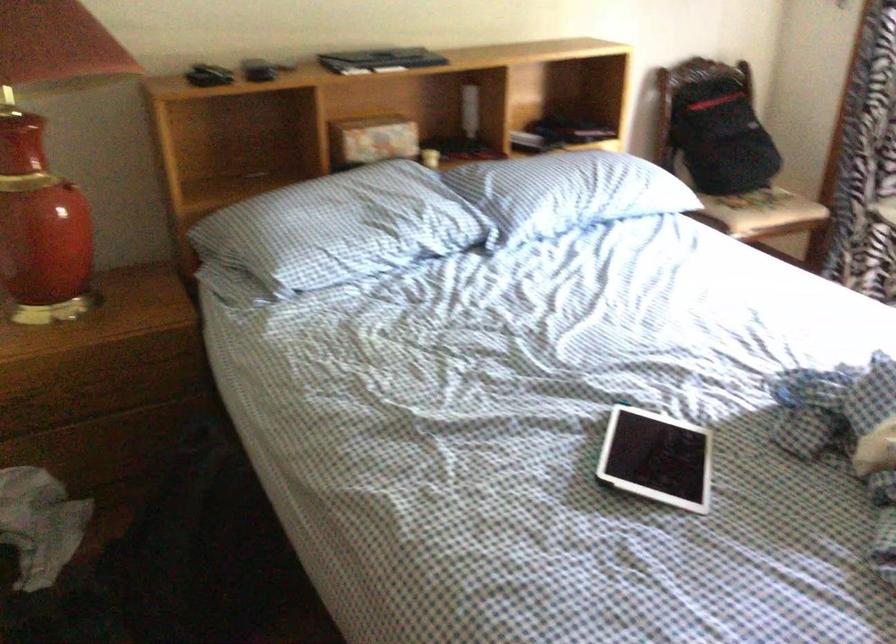
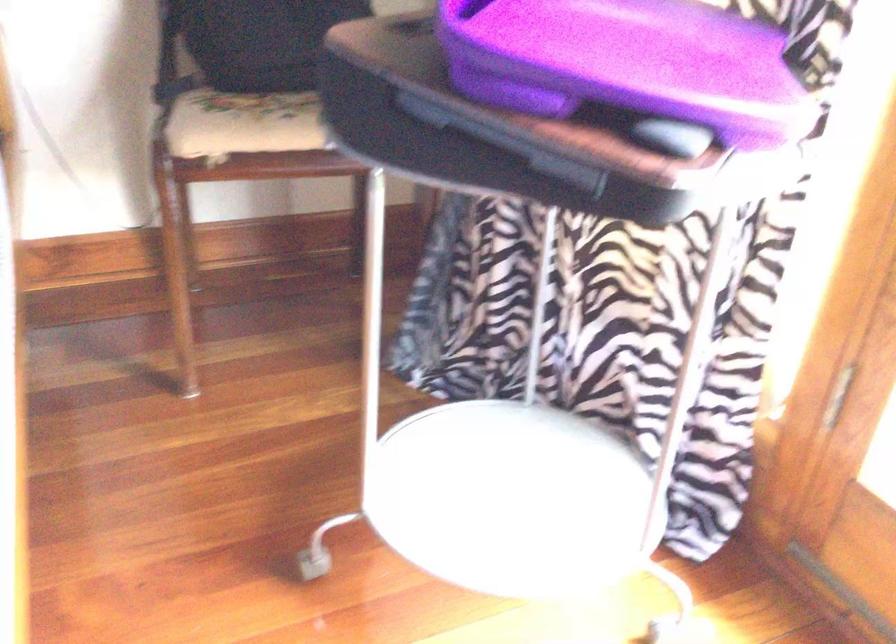
Which direction would the cameraman need to move to produce the second image?

The cameraman moved toward right, forward.